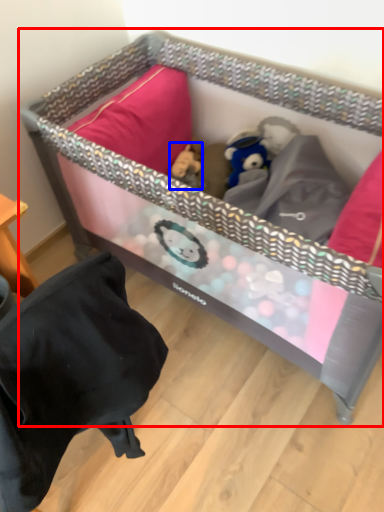
Question: Among these objects, which one is farthest to the camera, infant bed (highlighted by a red box) or toy (highlighted by a blue box)?

Choices:
 (A) infant bed
 (B) toy

Answer: (B)